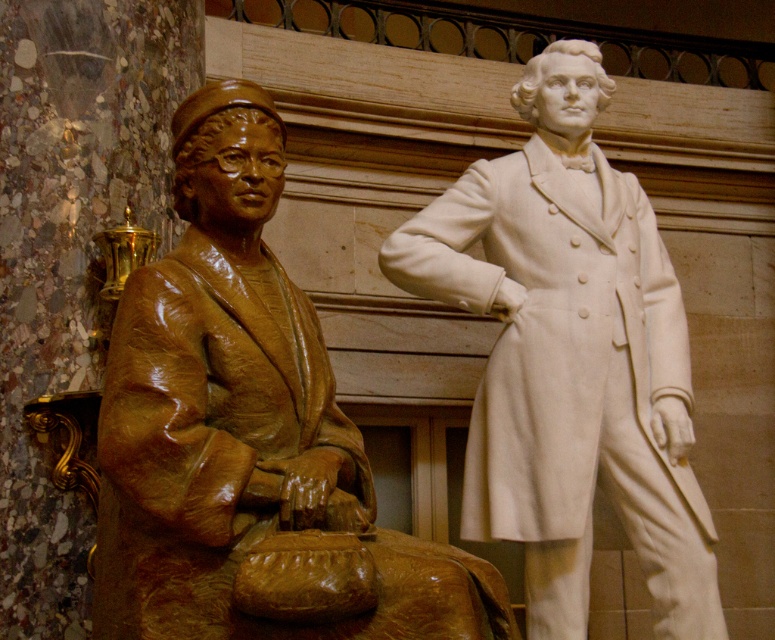
Question: Does bronze statue at left have a smaller size compared to white marble statue at right?

Choices:
 (A) yes
 (B) no

Answer: (A)

Question: Among these objects, which one is nearest to the camera?

Choices:
 (A) white marble statue at right
 (B) bronze statue at left

Answer: (B)

Question: Which point is farther from the camera taking this photo?

Choices:
 (A) (574, 384)
 (B) (455, 618)

Answer: (A)

Question: Which point is farther from the camera taking this photo?

Choices:
 (A) (618, 390)
 (B) (236, 433)

Answer: (A)

Question: Does bronze statue at left have a larger size compared to white marble statue at right?

Choices:
 (A) yes
 (B) no

Answer: (B)

Question: Does bronze statue at left have a greater width compared to white marble statue at right?

Choices:
 (A) yes
 (B) no

Answer: (A)